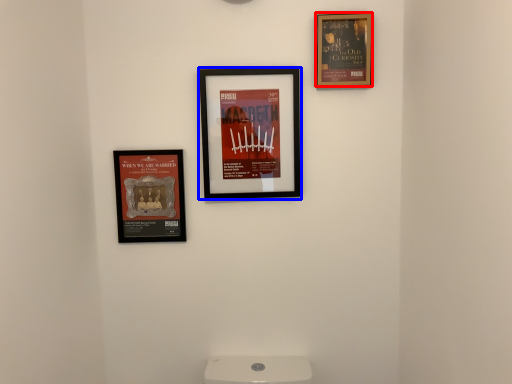
Question: Which object appears farthest to the camera in this image, picture frame (highlighted by a red box) or picture frame (highlighted by a blue box)?

Choices:
 (A) picture frame
 (B) picture frame

Answer: (B)